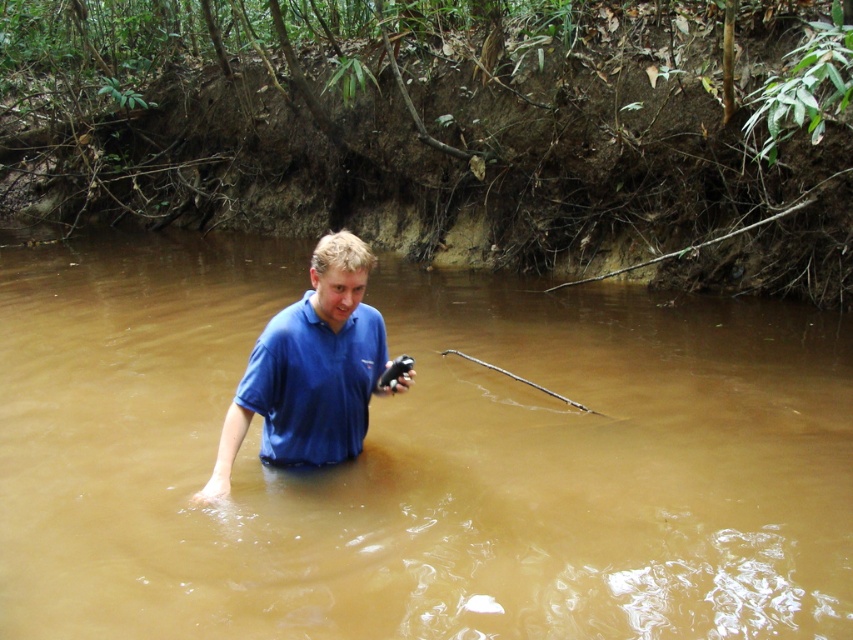
You are a hiker who just slipped into the water. You see the brown muddy water at center and the blue matte shirt at center. Which one is higher in position?

The brown muddy water at center is located above the blue matte shirt at center, so the brown muddy water at center is higher in position.

You are a photographer trying to capture a wide landscape shot of the riverbank. You are holding a camera and wearing a blue matte shirt at center. If you want to include both yourself and the entire steep bank covered with vegetation in the frame, would you need to use a wide angle lens? Explain your reasoning based on the distance between you and the camera.

The distance between the blue matte shirt at center and the camera is 4.02 meters. To capture both yourself and the entire steep bank in the frame, a wide angle lens would be necessary because it allows for a broader field of view, which is essential when the subject and background are relatively far apart. However, since the distance here is only 4.02 meters, a standard lens might also suffice depending on the camera sensor size and focal length. But for ensuring the entire bank and yourself are included,

Looking at this image, you are a fashion designer observing a person in a natural setting. You notice the blue matte shirt at center and the blue cotton polo shirt at center. Which of these two shirts is longer in length?

The blue matte shirt at center is taller than the blue cotton polo shirt at center, so the blue matte shirt at center is longer in length.